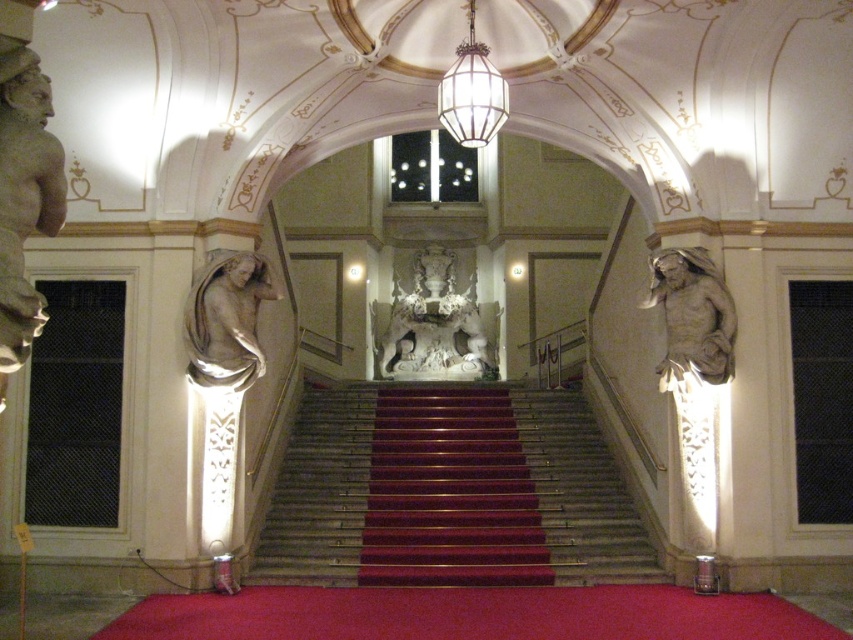
Question: Among these objects, which one is nearest to the camera?

Choices:
 (A) smooth gray stairs at center
 (B) white marble sculpture at center
 (C) clear glass lantern at center
 (D) matte stone statue at left

Answer: (D)

Question: Is shiny red carpet at center above clear glass lantern at center?

Choices:
 (A) no
 (B) yes

Answer: (A)

Question: Which is farther from the clear glass lantern at center?

Choices:
 (A) polished marble stairs at center
 (B) smooth gray stairs at center
 (C) white marble sculpture at center

Answer: (C)

Question: Estimate the real-world distances between objects in this image. Which object is farther from the smooth gray stairs at center?

Choices:
 (A) white marble sculpture at center
 (B) matte gray statue at left

Answer: (B)

Question: Is polished marble stairs at center in front of matte gray statue at left?

Choices:
 (A) no
 (B) yes

Answer: (A)

Question: Does shiny red carpet at center appear over matte gray statue at left?

Choices:
 (A) no
 (B) yes

Answer: (A)